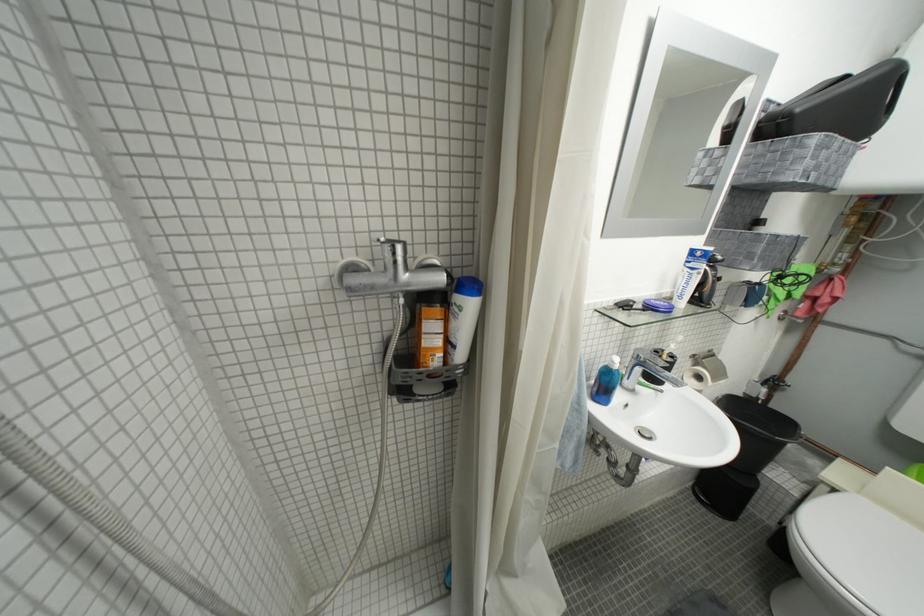
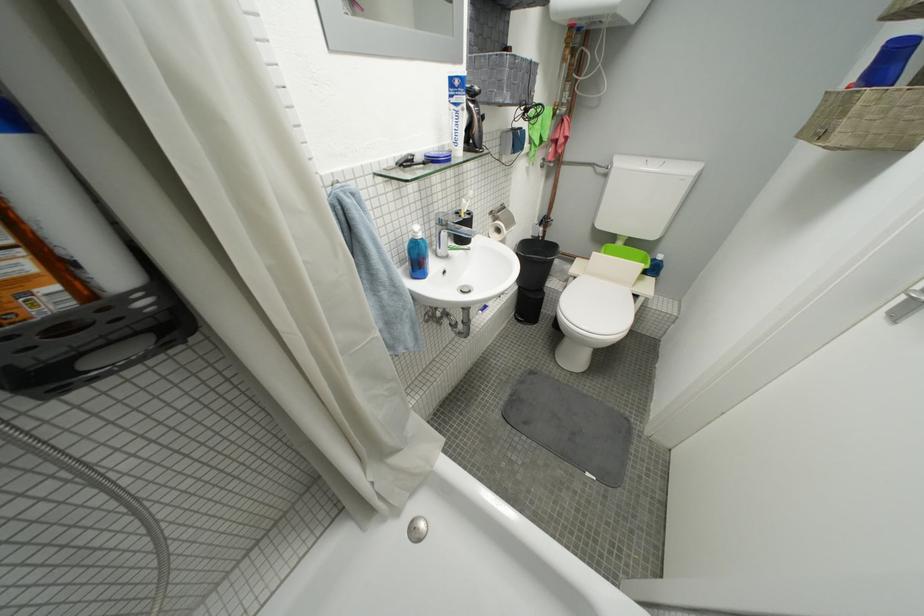
Where in the second image is the point corresponding to point (845, 493) from the first image?

(584, 281)